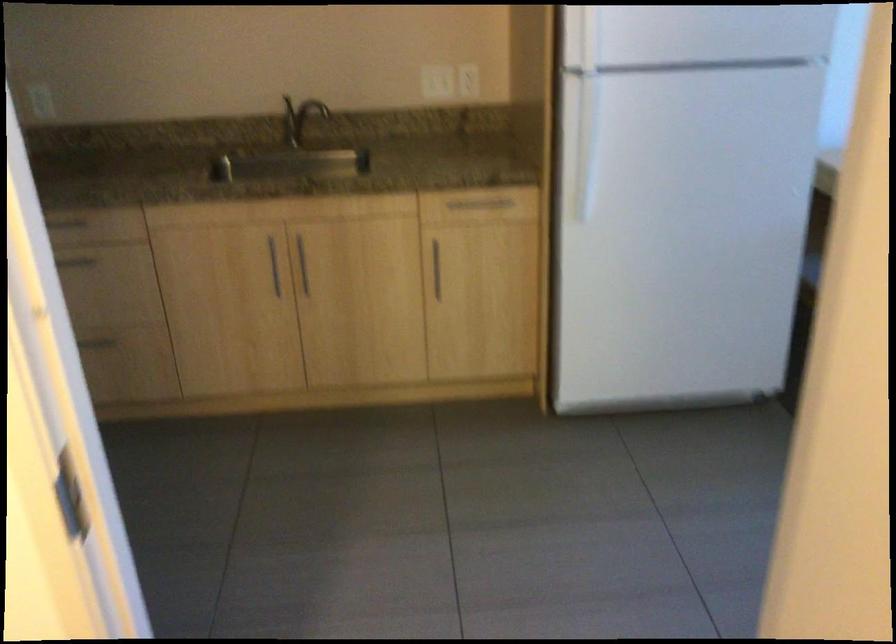
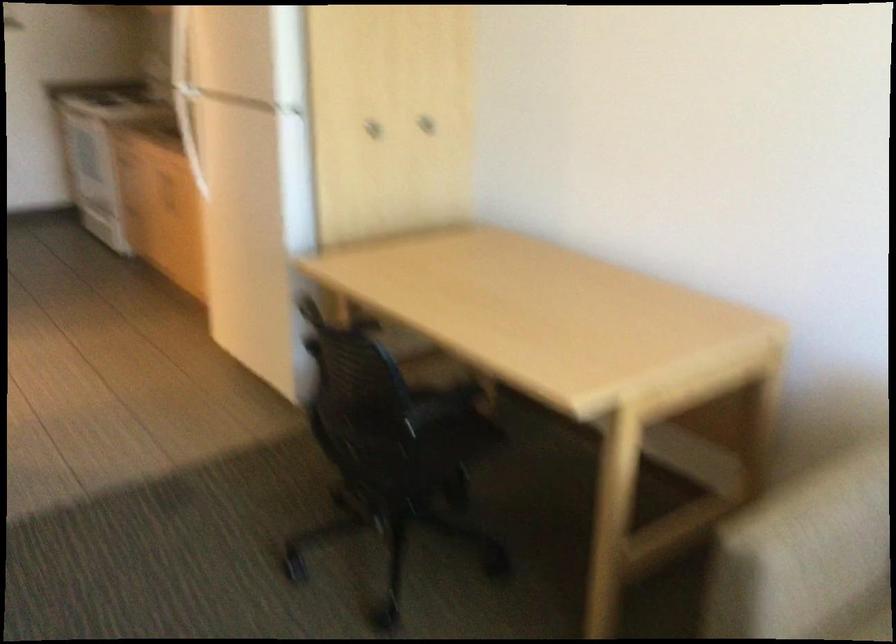
Question: I am providing you with two images of the same scene from different viewpoints. After the viewpoint changes to image2, which objects are now occluded?

Choices:
 (A) box plastic handle
 (B) refrigerator door handle
 (C) metal cabinet handle
 (D) chair sitting surface

Answer: (C)